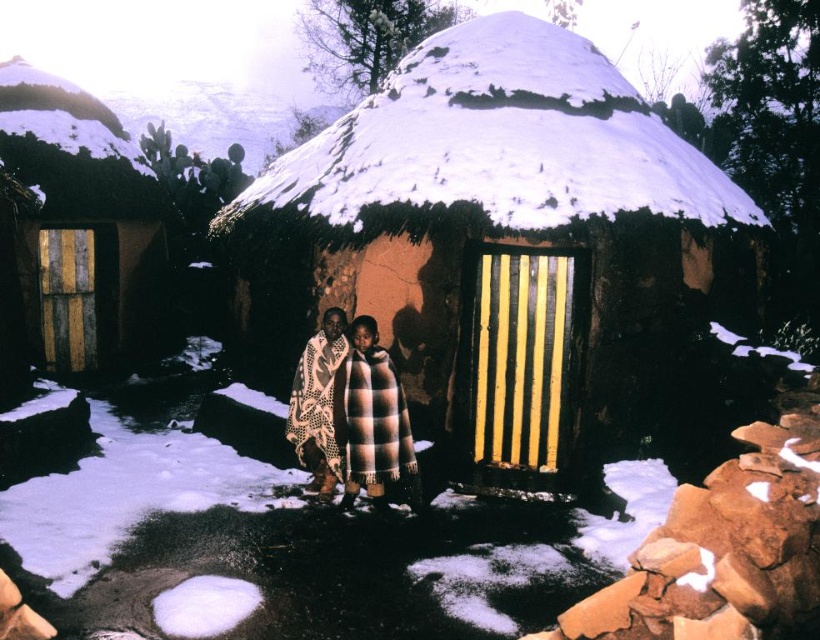
You are a traveler carrying a large backpack and need to enter the wooden door at left. The brown checkered blanket at center is blocking the entrance. Can you pass through the door without moving the blanket?

The wooden door at left is wider than the brown checkered blanket at center, so you can pass through the door without moving the blanket since the door is wider than the blanket.

In the scene shown: You are standing in front of the central snow hut and want to take a photo. You notice two points marked on the ground in front of you. The first point is at coordinate point(331, 346) and the second is at point(317, 360). Which point should you stand on to ensure the camera captures the central snow hut more clearly?

You should stand on point(331, 346) because it is closer to the camera and will provide a clearer view of the central snow hut.

You are a traveler wanting to enter the wooden door at left but need to pass by the brown checkered blanket at center. Considering their sizes, will you have enough space to walk around the blanket and reach the door?

The wooden door at left has a larger size compared to brown checkered blanket at center. Since the door is bigger, there should be sufficient space to walk around the blanket and reach the door.